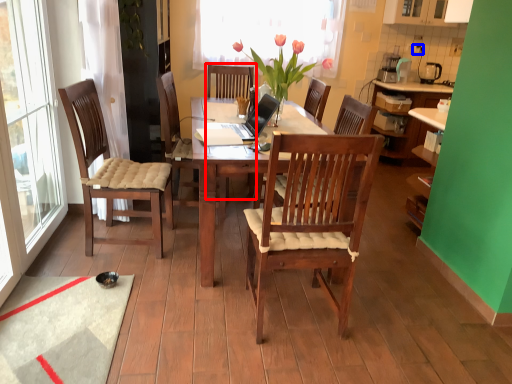
Question: Which object is closer to the camera taking this photo, armchair (highlighted by a red box) or power outlet (highlighted by a blue box)?

Choices:
 (A) armchair
 (B) power outlet

Answer: (A)